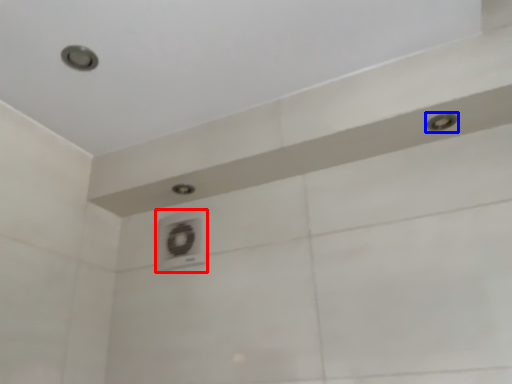
Question: Which point is closer to the camera, air conditioner (highlighted by a red box) or shower (highlighted by a blue box)?

Choices:
 (A) air conditioner
 (B) shower

Answer: (B)